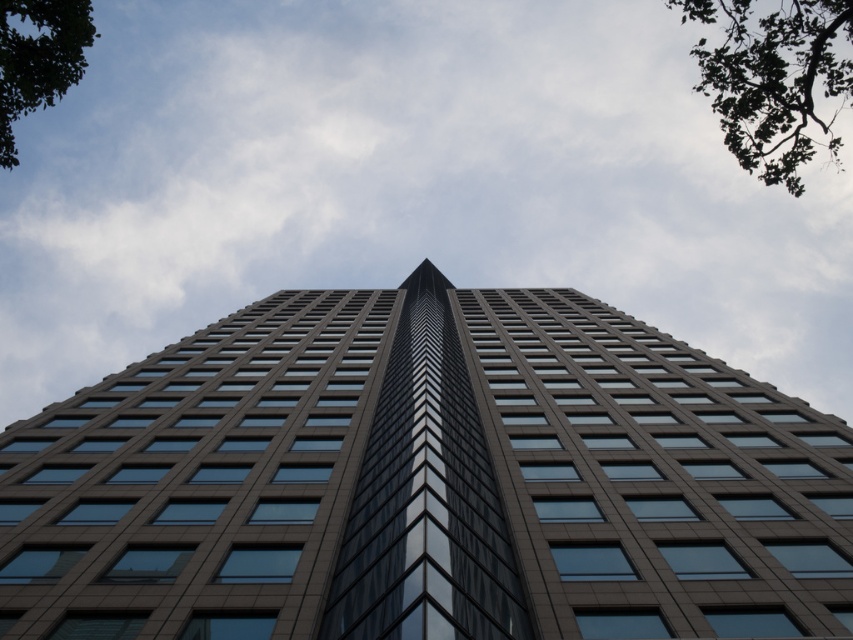
Question: Is green leafy tree at upper right positioned in front of green leafy tree at upper left?

Choices:
 (A) no
 (B) yes

Answer: (A)

Question: Which of these objects is positioned closest to the green leafy tree at upper right?

Choices:
 (A) smooth glass tower at center
 (B) green leafy tree at upper left

Answer: (A)

Question: In this image, where is smooth glass tower at center located relative to green leafy tree at upper left?

Choices:
 (A) below
 (B) above

Answer: (A)

Question: Is smooth glass tower at center to the left of green leafy tree at upper left from the viewer's perspective?

Choices:
 (A) no
 (B) yes

Answer: (A)

Question: Which object is farther from the camera taking this photo?

Choices:
 (A) green leafy tree at upper left
 (B) green leafy tree at upper right

Answer: (B)

Question: Which is farther from the green leafy tree at upper left?

Choices:
 (A) smooth glass tower at center
 (B) green leafy tree at upper right

Answer: (B)